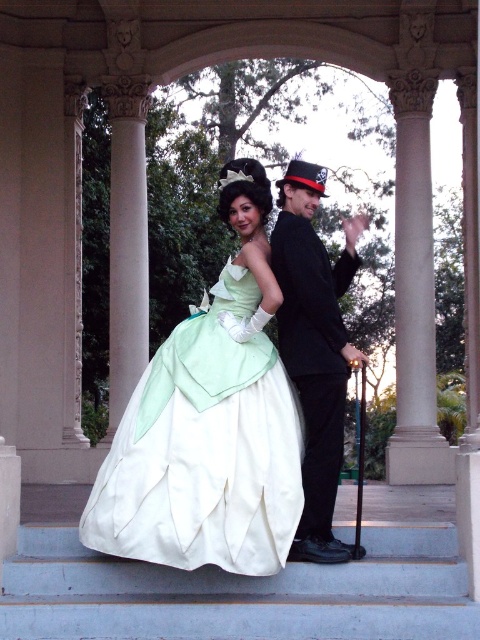
Does white smooth stairs at lower center come behind shiny black suit at center?

That is False.

Between white smooth stairs at lower center and shiny black suit at center, which one is positioned lower?

white smooth stairs at lower center is below.

Does point (73, 550) lie in front of point (298, 348)?

That is False.

This screenshot has height=640, width=480. Find the location of `white smooth stairs at lower center`. white smooth stairs at lower center is located at coordinates (240, 593).

Which is below, linen-like green dress at center or shiny black suit at center?

linen-like green dress at center is lower down.

Who is taller, linen-like green dress at center or shiny black suit at center?

With more height is shiny black suit at center.

What do you see at coordinates (204, 451) in the screenshot? This screenshot has width=480, height=640. I see `linen-like green dress at center` at bounding box center [204, 451].

This screenshot has height=640, width=480. I want to click on linen-like green dress at center, so click(x=204, y=451).

Between point (178, 481) and point (274, 616), which one is positioned in front?

Point (274, 616)

Does linen-like green dress at center appear on the right side of white smooth stairs at lower center?

No, linen-like green dress at center is not to the right of white smooth stairs at lower center.

This screenshot has height=640, width=480. What are the coordinates of `linen-like green dress at center` in the screenshot? It's located at 204,451.